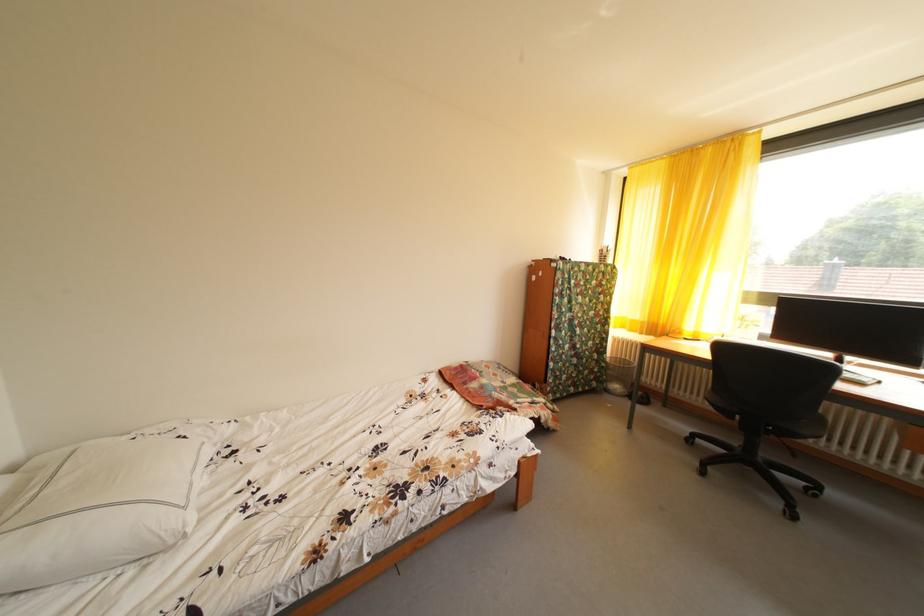
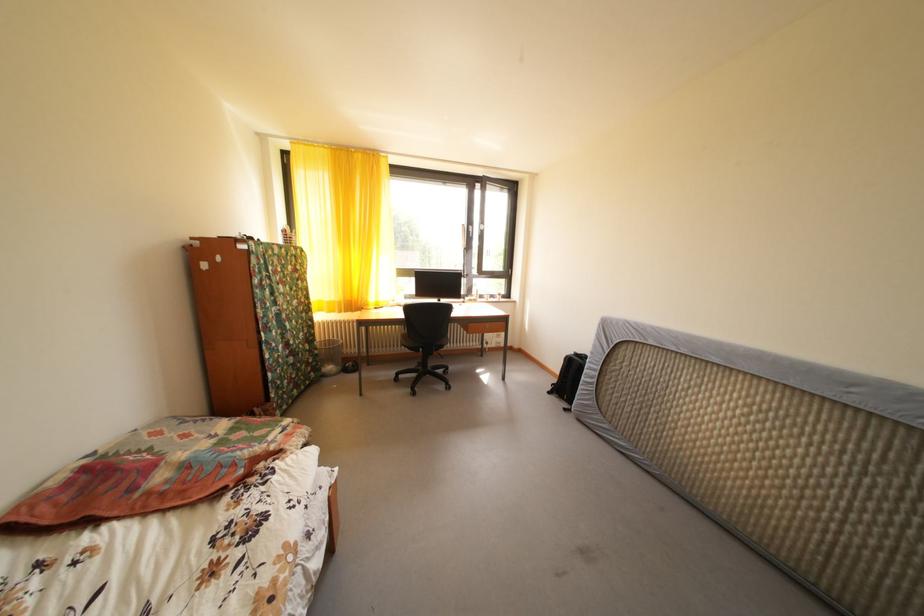
Question: How did the camera likely rotate?

Choices:
 (A) Left
 (B) Right
 (C) Up
 (D) Down

Answer: (B)